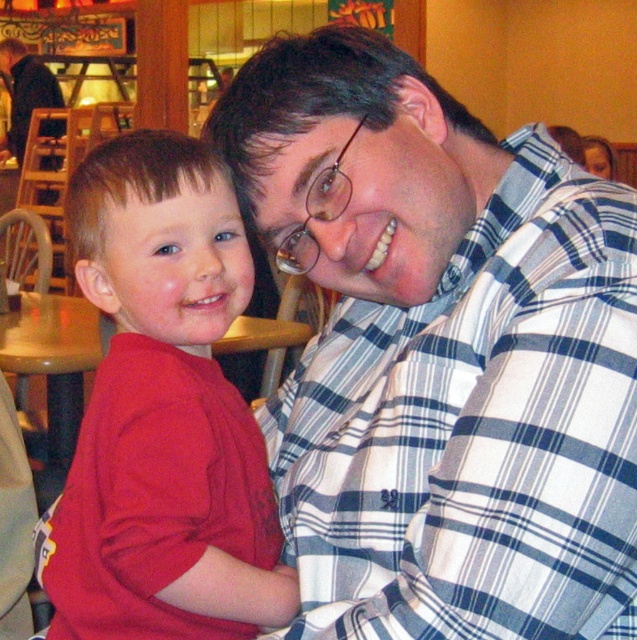
You are standing at the point labeled point (217, 592) and want to move to the point labeled point (304, 628). Which direction should you move to reach your destination?

You should move forward because point (304, 628) is in front of point (217, 592).

You are a photographer standing 10 feet away from the two people in the image. You want to take a photo of both the white plaid shirt at upper right and the matte red shirt at left in the same frame. Can you fit both shirts into the camera frame if the camera has a 5.90 inch wide field of view?

The white plaid shirt at upper right is 5.90 inches away from the matte red shirt at left, so yes, the camera with a 5.90 inch wide field of view can capture both shirts in the same frame since the distance between them matches the field of view width.